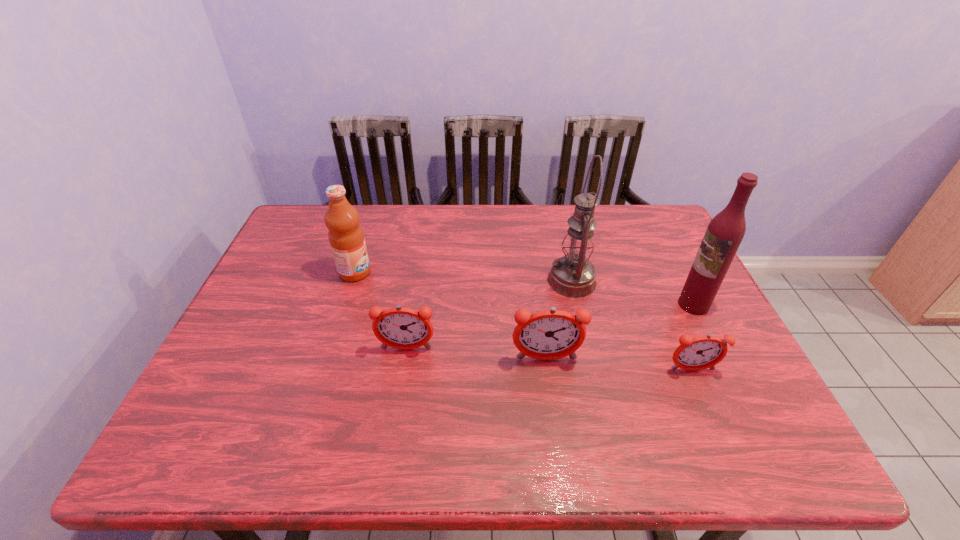
Identify the location of object that stands as the second closest to the oil lamp. (724, 234).

Point out which object is positioned as the nearest to the fruit juice. Please provide its 2D coordinates. Your answer should be formatted as a tuple, i.e. [(x, y)], where the tuple contains the x and y coordinates of a point satisfying the conditions above.

[(402, 328)]

Point out which alarm clock is positioned as the third nearest to the liquor. Please provide its 2D coordinates. Your answer should be formatted as a tuple, i.e. [(x, y)], where the tuple contains the x and y coordinates of a point satisfying the conditions above.

[(402, 328)]

Select which alarm clock appears as the closest to the second alarm clock from right to left. Please provide its 2D coordinates. Your answer should be formatted as a tuple, i.e. [(x, y)], where the tuple contains the x and y coordinates of a point satisfying the conditions above.

[(402, 328)]

This screenshot has height=540, width=960. In order to click on vacant space that satisfies the following two spatial constraints: 1. on the label of the liquor; 2. on the front-facing side of the leftmost alarm clock in this screenshot , I will do `click(715, 349)`.

Identify the location of vacant point that satisfies the following two spatial constraints: 1. on the back side of the oil lamp; 2. on the front label of the fruit juice. (570, 272).

This screenshot has width=960, height=540. Find the location of `free location that satisfies the following two spatial constraints: 1. on the label of the liquor; 2. on the front-facing side of the second alarm clock from right to left`. free location that satisfies the following two spatial constraints: 1. on the label of the liquor; 2. on the front-facing side of the second alarm clock from right to left is located at coordinates (721, 359).

Where is `vacant space that satisfies the following two spatial constraints: 1. on the label of the liquor; 2. on the front-facing side of the shortest alarm clock`? vacant space that satisfies the following two spatial constraints: 1. on the label of the liquor; 2. on the front-facing side of the shortest alarm clock is located at coordinates point(726,370).